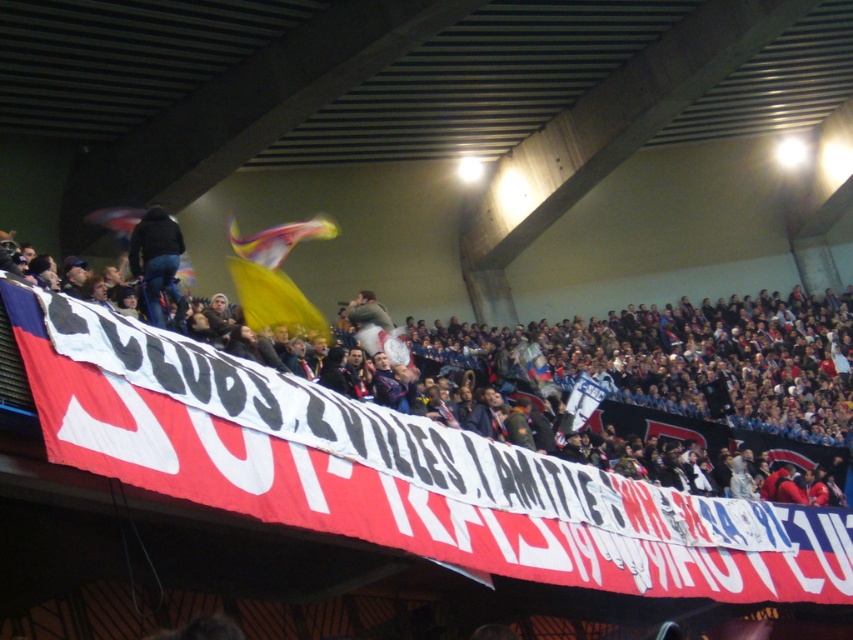
Describe the element at coordinates (395, 472) in the screenshot. I see `red fabric banner at center` at that location.

How much distance is there between red fabric banner at center and dark blue jeans at center?

16.84 meters

The image size is (853, 640). Find the location of `red fabric banner at center`. red fabric banner at center is located at coordinates (395, 472).